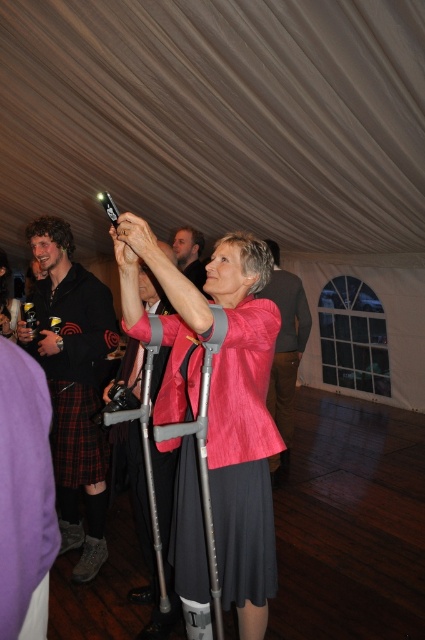
Question: Which point is closer to the camera?

Choices:
 (A) (181, 572)
 (B) (91, 493)
 (C) (178, 243)

Answer: (A)

Question: Which object appears farthest from the camera in this image?

Choices:
 (A) metallic gray crutch at center
 (B) black kilt at left
 (C) pink fabric crutches at center

Answer: (B)

Question: From the image, what is the correct spatial relationship of pink fabric crutches at center in relation to metallic gray crutch at center?

Choices:
 (A) left
 (B) right

Answer: (B)

Question: Can you confirm if metallic gray crutch at center is wider than smooth skin face at center?

Choices:
 (A) no
 (B) yes

Answer: (A)

Question: Which point appears closest to the camera in this image?

Choices:
 (A) (68, 452)
 (B) (288, 461)

Answer: (A)

Question: Is black kilt at left in front of metallic gray crutch at center?

Choices:
 (A) yes
 (B) no

Answer: (B)